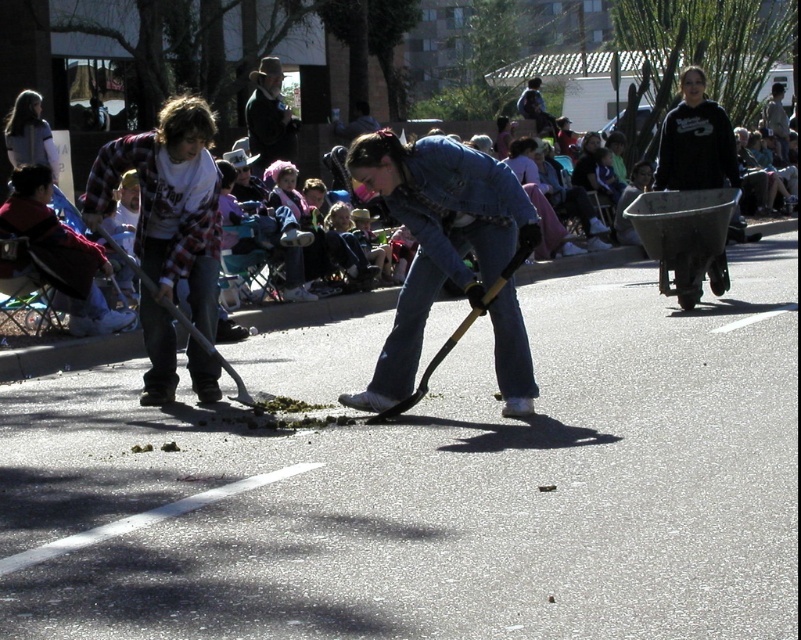
You are a photographer trying to capture a photo of the denim jeans at left and the rustic brown hat at upper center in the scene. Based on their positions, can you determine which object is lower in the image?

The denim jeans at left is located below rustic brown hat at upper center, so the denim jeans at left is lower in the image.

You are a photographer trying to capture a closeup of the person in denim jeans at left. Given their exact coordinates, what is the best direction to move your camera to frame them properly?

The denim jeans at left are located at coordinates point (157, 348). To frame them properly, adjust your camera to focus on that specific point.